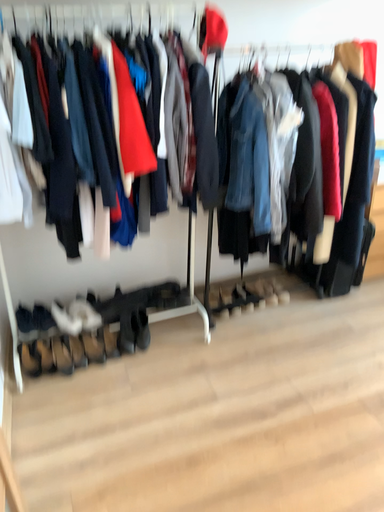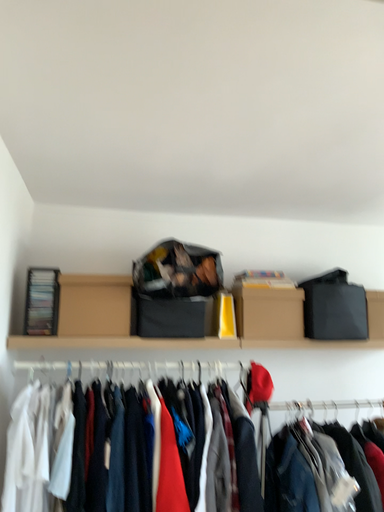
Question: Which way did the camera rotate in the video?

Choices:
 (A) rotated left
 (B) rotated right

Answer: (A)